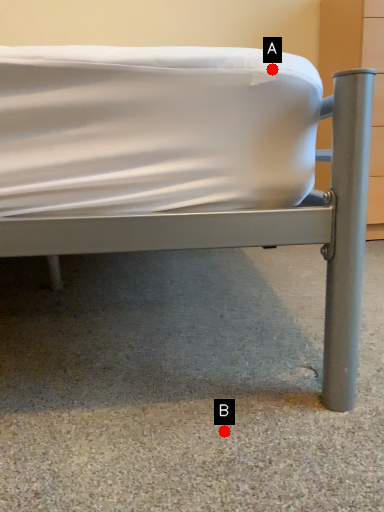
Question: Two points are circled on the image, labeled by A and B beside each circle. Which point is farther to the camera?

Choices:
 (A) A is further
 (B) B is further

Answer: (B)